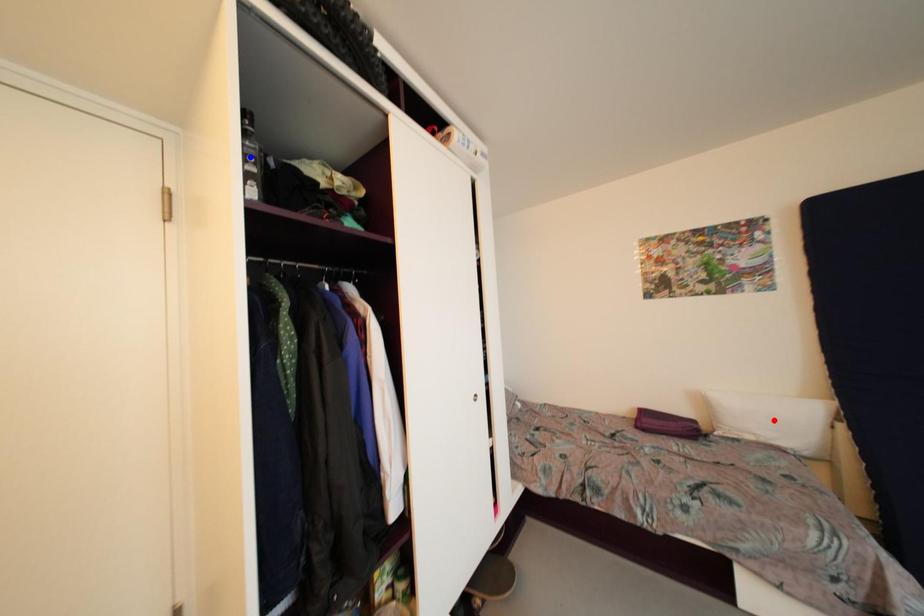
Question: Two points are marked on the image. Which point is closer to the camera?

Choices:
 (A) Blue point is closer.
 (B) Red point is closer.

Answer: (A)